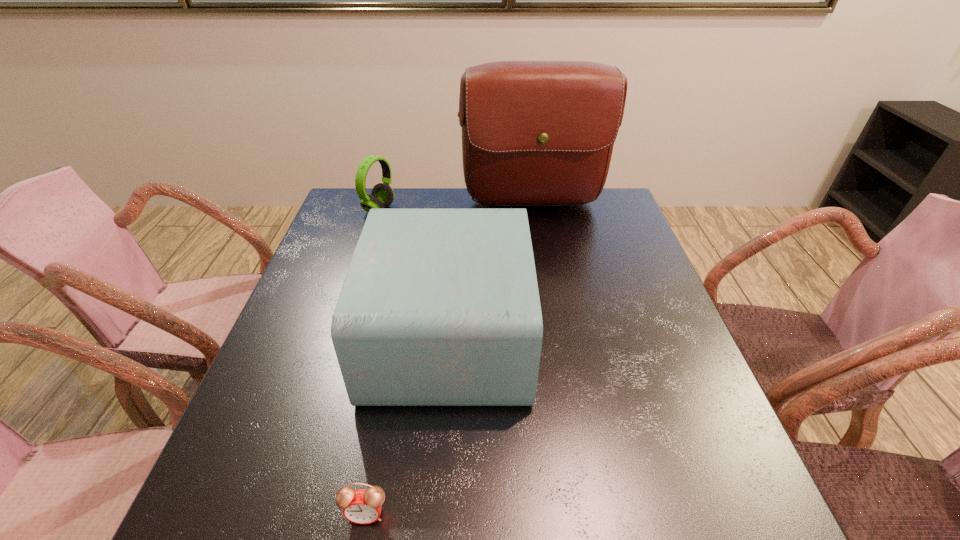
Find the location of a particular element. The image size is (960, 540). blank area at the right edge is located at coordinates (641, 349).

The image size is (960, 540). In the image, there is a desktop. Find the location of `vacant area at the near left corner`. vacant area at the near left corner is located at coordinates (211, 530).

This screenshot has width=960, height=540. In the image, there is a desktop. In order to click on vacant space at the far right corner in this screenshot , I will do `click(605, 223)`.

In the image, there is a desktop. Find the location of `free space at the near right corner`. free space at the near right corner is located at coordinates (728, 495).

Image resolution: width=960 pixels, height=540 pixels. In order to click on free space between the tallest object and the leftmost object in this screenshot , I will do `click(456, 207)`.

Image resolution: width=960 pixels, height=540 pixels. What are the coordinates of `object that is the third closest one to the shortest object` in the screenshot? It's located at (382, 195).

Identify which object is located as the third nearest to the tallest object. Please provide its 2D coordinates. Your answer should be formatted as a tuple, i.e. [(x, y)], where the tuple contains the x and y coordinates of a point satisfying the conditions above.

[(363, 506)]

Where is `free space that satisfies the following two spatial constraints: 1. on the open flap of the satchel; 2. on the front panel of the third farthest object`? The width and height of the screenshot is (960, 540). free space that satisfies the following two spatial constraints: 1. on the open flap of the satchel; 2. on the front panel of the third farthest object is located at coordinates (555, 335).

This screenshot has width=960, height=540. In order to click on free spot that satisfies the following two spatial constraints: 1. on the open flap of the satchel; 2. on the front panel of the second tallest object in this screenshot , I will do `click(555, 335)`.

Where is `vacant area that satisfies the following two spatial constraints: 1. on the front panel of the third farthest object; 2. on the clock face of the shortest object`? vacant area that satisfies the following two spatial constraints: 1. on the front panel of the third farthest object; 2. on the clock face of the shortest object is located at coordinates (438, 514).